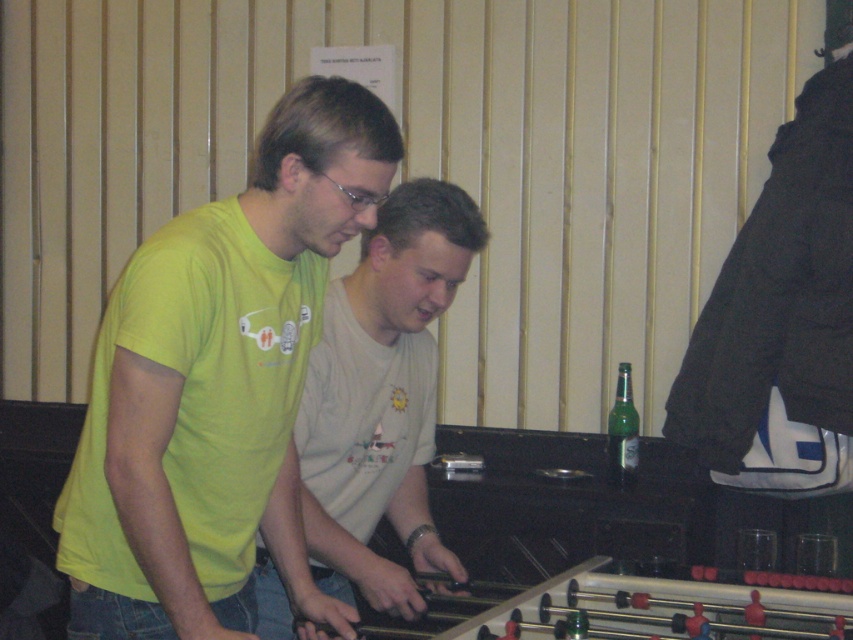
Question: Is light green t-shirt at center positioned behind green glass bottle at right?

Choices:
 (A) yes
 (B) no

Answer: (B)

Question: Which is nearer to the light green t-shirt at center?

Choices:
 (A) matte green t-shirt at center
 (B) green glass bottle at right

Answer: (A)

Question: Is matte green t-shirt at center wider than light green t-shirt at center?

Choices:
 (A) no
 (B) yes

Answer: (B)

Question: Where is light green t-shirt at center located in relation to green glass bottle at right in the image?

Choices:
 (A) right
 (B) left

Answer: (B)

Question: Which point is closer to the camera taking this photo?

Choices:
 (A) (292, 481)
 (B) (619, 420)

Answer: (A)

Question: Which object is the farthest from the light green t-shirt at center?

Choices:
 (A) green glass bottle at right
 (B) matte green t-shirt at center

Answer: (A)